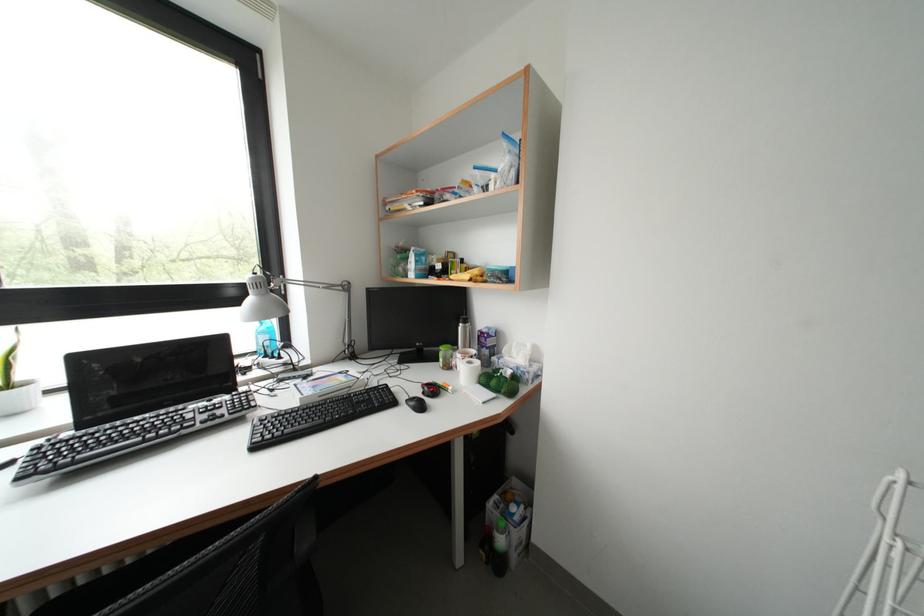
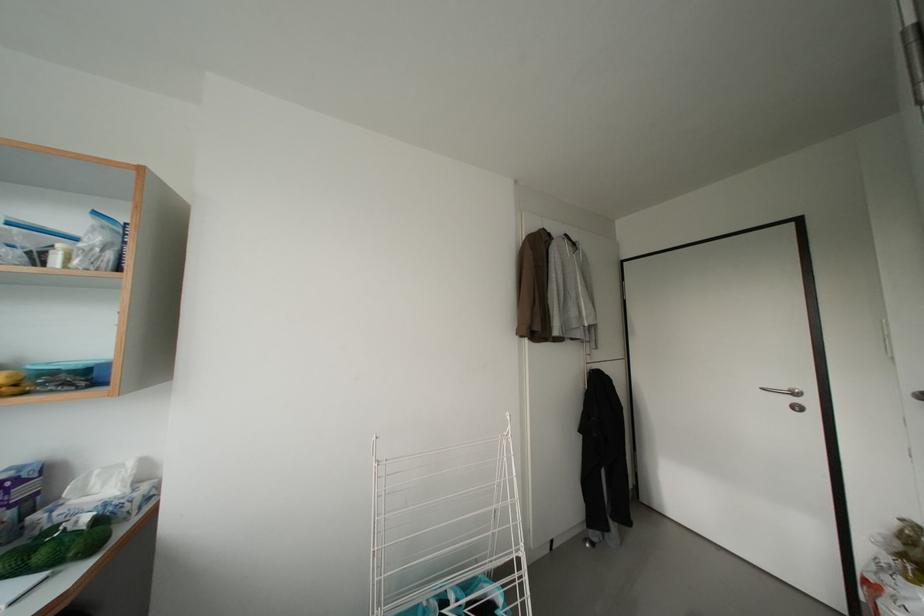
The point at (492,334) is marked in the first image. Where is the corresponding point in the second image?

(11, 482)